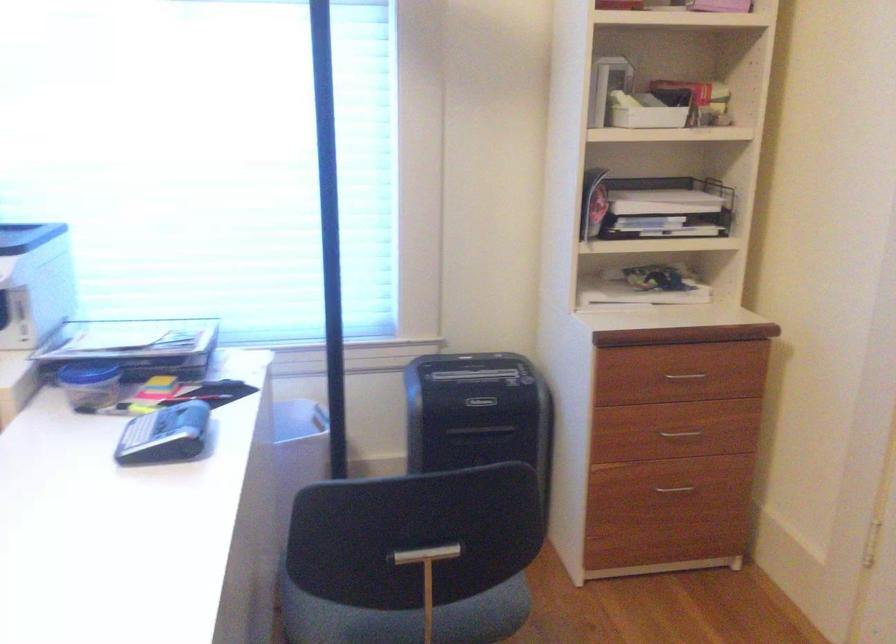
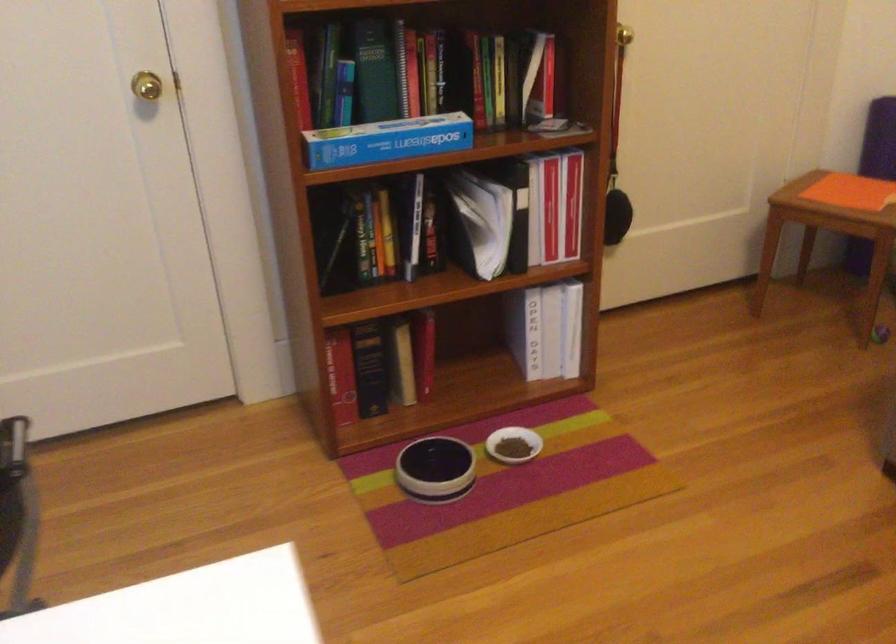
Based on the photo, based on the continuous images, in which direction is the camera rotating?

The camera rotated toward right-down.